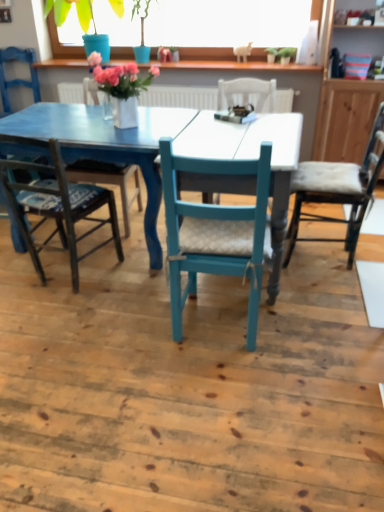
Question: From a real-world perspective, is white cushioned chair at right, which is the 6th chair in left-to-right order, physically below matte blue chair at center, the 4th chair when ordered from right to left?

Choices:
 (A) no
 (B) yes

Answer: (B)

Question: Is white cushioned chair at right, which is the 6th chair in left-to-right order, positioned with its back to matte blue chair at center, positioned as the 3th chair in left-to-right order?

Choices:
 (A) yes
 (B) no

Answer: (B)

Question: From the image's perspective, is white cushioned chair at right, which is the 6th chair in left-to-right order, over matte blue chair at center, positioned as the 3th chair in left-to-right order?

Choices:
 (A) no
 (B) yes

Answer: (B)

Question: Considering the relative sizes of white cushioned chair at right, which is the 6th chair in left-to-right order, and matte blue chair at center, the 4th chair when ordered from right to left, in the image provided, is white cushioned chair at right, which is the 6th chair in left-to-right order, bigger than matte blue chair at center, the 4th chair when ordered from right to left,?

Choices:
 (A) no
 (B) yes

Answer: (B)

Question: In terms of height, does matte blue pot at upper center look taller or shorter compared to teal wood chair at center, placed as the fifth chair when sorted from left to right?

Choices:
 (A) short
 (B) tall

Answer: (A)

Question: Looking at the image, does matte blue pot at upper center seem bigger or smaller compared to teal wood chair at center, placed as the fifth chair when sorted from left to right?

Choices:
 (A) small
 (B) big

Answer: (A)

Question: Does point (52, 2) appear closer or farther from the camera than point (218, 205)?

Choices:
 (A) farther
 (B) closer

Answer: (A)

Question: Choose the correct answer: Is matte blue pot at upper center inside teal wood chair at center, placed as the fifth chair when sorted from left to right, or outside it?

Choices:
 (A) outside
 (B) inside

Answer: (A)

Question: Does point (61, 49) appear closer or farther from the camera than point (33, 74)?

Choices:
 (A) farther
 (B) closer

Answer: (A)

Question: Is matte blue pot at upper center inside or outside of matte blue chair at left, the first chair when ordered from left to right?

Choices:
 (A) inside
 (B) outside

Answer: (B)

Question: Is matte blue pot at upper center to the left or to the right of matte blue chair at left, the first chair when ordered from left to right, in the image?

Choices:
 (A) right
 (B) left

Answer: (A)

Question: From the image's perspective, relative to matte blue chair at left, the first chair when ordered from left to right, is matte blue pot at upper center above or below?

Choices:
 (A) above
 (B) below

Answer: (A)

Question: Looking at the image, does matte blue chair at left, the 2th chair when ordered from left to right, seem bigger or smaller compared to matte blue chair at left, the first chair when ordered from left to right?

Choices:
 (A) big
 (B) small

Answer: (A)

Question: Looking at their shapes, would you say matte blue chair at left, the 2th chair when ordered from left to right, is wider or thinner than matte blue chair at left, the first chair when ordered from left to right?

Choices:
 (A) wide
 (B) thin

Answer: (A)